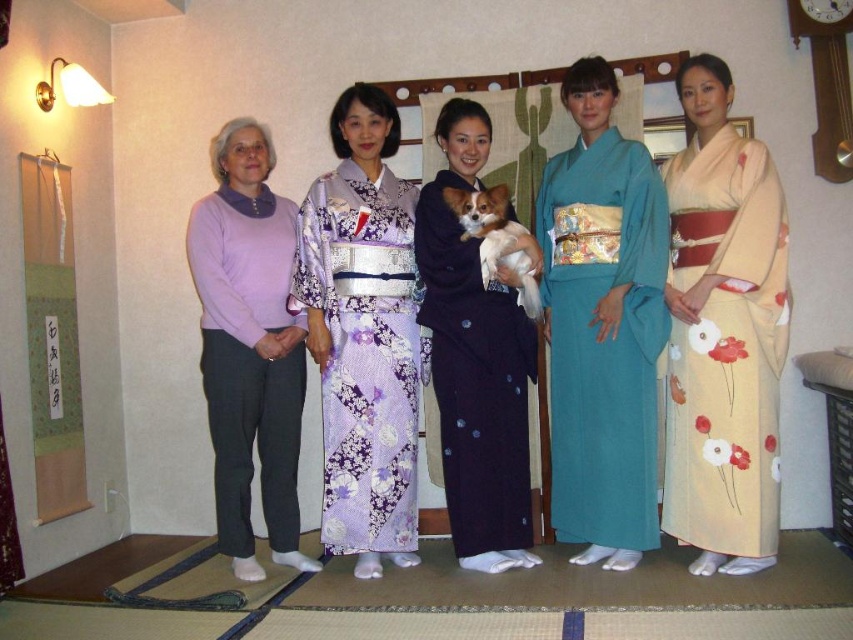
Question: Is beige silk kimono at right further to camera compared to lavender floral kimono at center?

Choices:
 (A) no
 (B) yes

Answer: (A)

Question: Which object is the closest to the purple sweater at left?

Choices:
 (A) lavender floral kimono at center
 (B) beige silk kimono at right

Answer: (A)

Question: Does teal silk kimono at center have a smaller size compared to dark blue kimono at center?

Choices:
 (A) no
 (B) yes

Answer: (A)

Question: Which point appears farthest from the camera in this image?

Choices:
 (A) (492, 248)
 (B) (415, 488)

Answer: (B)

Question: Does teal silk kimono at center lie behind purple sweater at left?

Choices:
 (A) yes
 (B) no

Answer: (B)

Question: Which object appears closest to the camera in this image?

Choices:
 (A) purple sweater at left
 (B) beige silk kimono at right

Answer: (B)